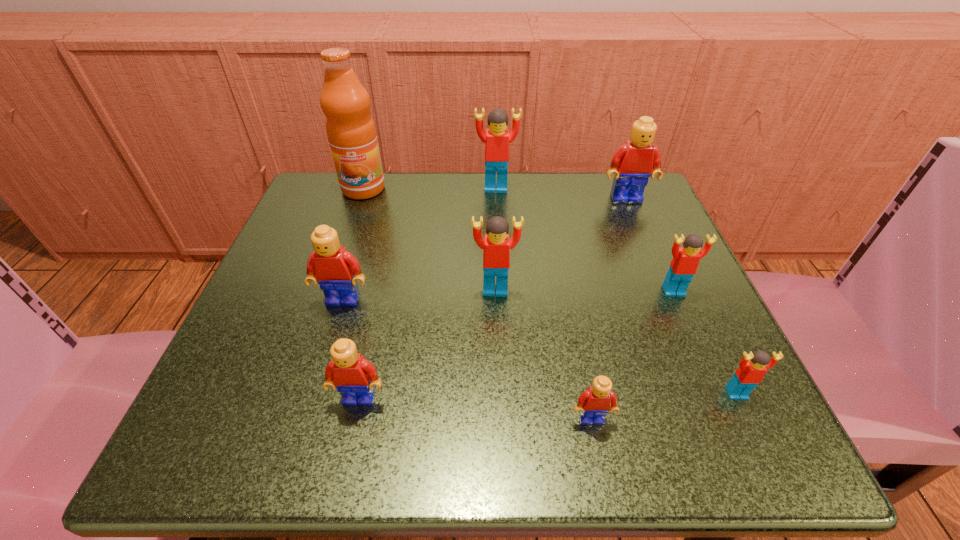
You are a GUI agent. You are given a task and a screenshot of the screen. Output one action in this format:
    pyautogui.click(x=<x>, y=<y>)
    Task: Click on the Lego that is at the left edge
    The image size is (960, 540).
    Given the screenshot: What is the action you would take?
    pyautogui.click(x=336, y=270)

I want to click on object that is at the far left corner, so click(x=351, y=132).

This screenshot has height=540, width=960. I want to click on object that is at the far right corner, so click(638, 159).

Where is `object that is positioned at the near right corner`? The height and width of the screenshot is (540, 960). object that is positioned at the near right corner is located at coordinates (752, 367).

Where is `vacant region at the far edge of the desktop`? The height and width of the screenshot is (540, 960). vacant region at the far edge of the desktop is located at coordinates (407, 205).

This screenshot has height=540, width=960. I want to click on vacant region at the near edge of the desktop, so click(487, 422).

Where is `vacant space at the left edge of the desktop`? vacant space at the left edge of the desktop is located at coordinates (358, 238).

Identify the location of free spot at the right edge of the desktop. (629, 275).

The width and height of the screenshot is (960, 540). I want to click on vacant space at the far right corner of the desktop, so click(642, 228).

At what (x,y) coordinates should I click in order to perform the action: click on unoccupied position between the third biggest yellow Lego and the farthest red Lego. Please return your answer as a coordinate pair (x, y). This screenshot has width=960, height=540. Looking at the image, I should click on (428, 293).